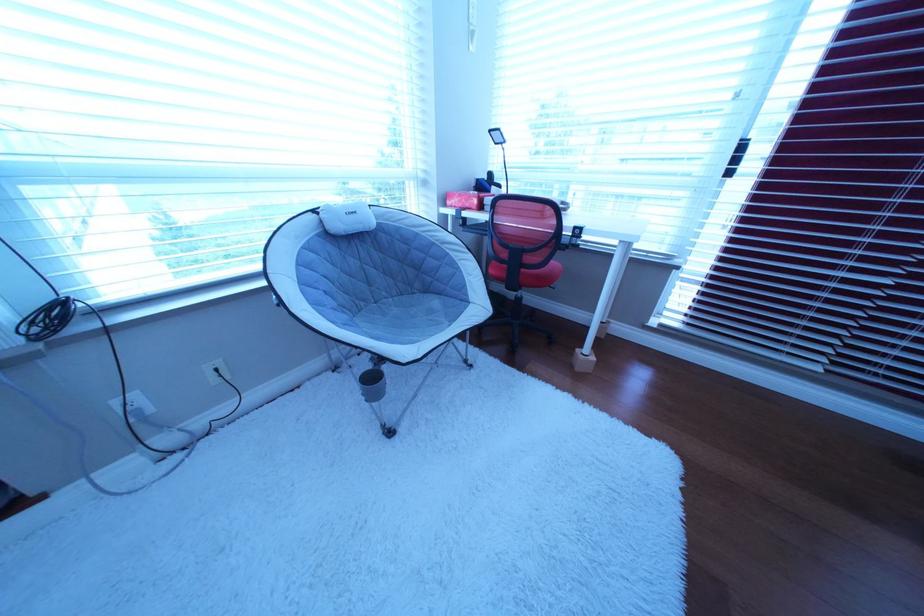
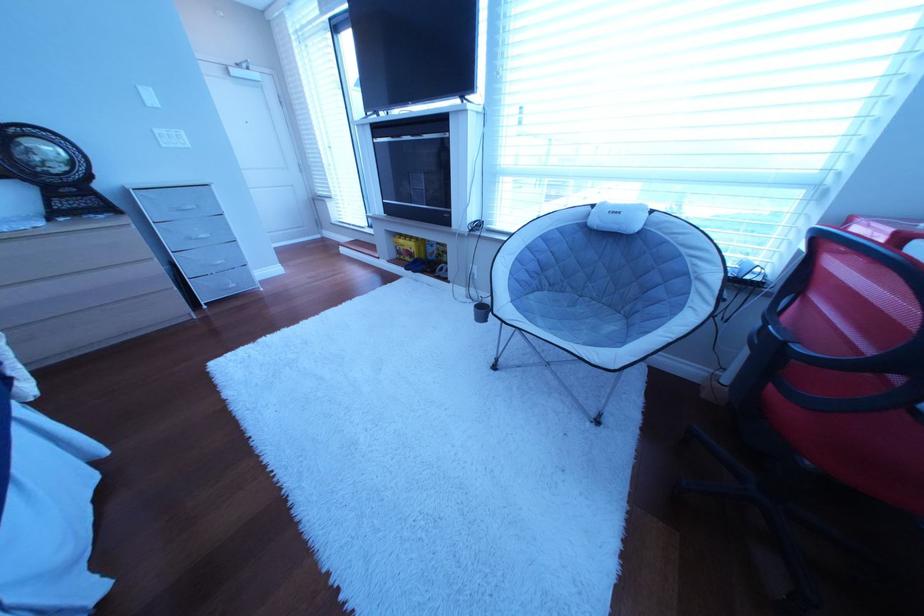
How did the camera likely rotate?

The camera rotated toward left-down.